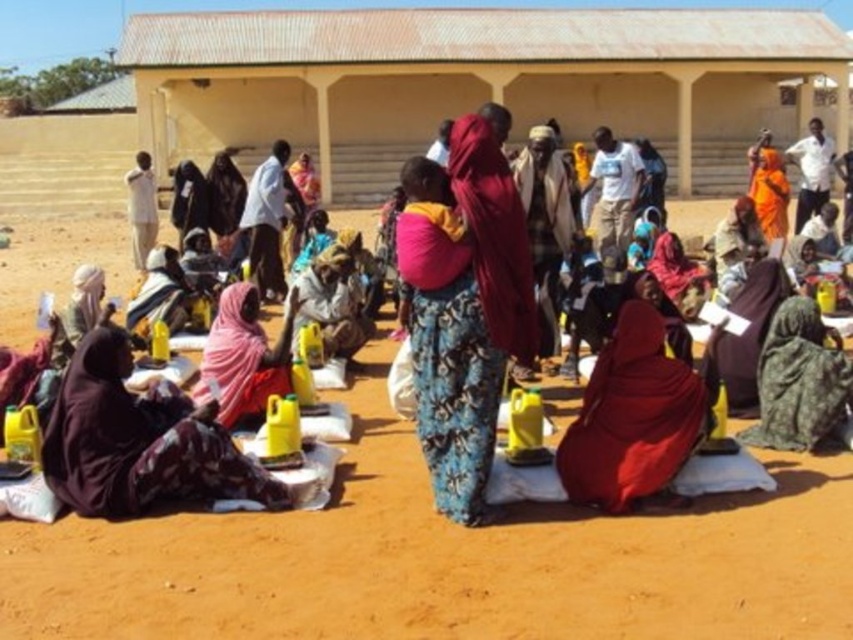
You are an aid worker at this event and need to identify which head covering is higher when viewed from the front. Which one is taller between the pink fabric headscarf at lower left and the matte black turban at left?

The pink fabric headscarf at lower left is taller than the matte black turban at left according to the description.

You are organizing a community event and need to place a large poster on the ground at the center. The poster is the same size as the pink fabric headscarf at lower left. Will the brown sandy dirt at center be enough to cover the poster completely?

The brown sandy dirt at center is larger in size than the pink fabric headscarf at lower left, so the dirt area can fully cover the poster since the dirt is bigger than the headscarf.

You are a photographer at the event and want to capture both the dark purple fabric at lower left and the pink fabric headscarf at lower left in a single frame. Which fabric should you position closer to the center of the image to ensure both fit comfortably?

The dark purple fabric at lower left is wider than the pink fabric headscarf at lower left. Position the wider dark purple fabric at lower left closer to the center to accommodate its larger size, ensuring both fit comfortably in the frame.